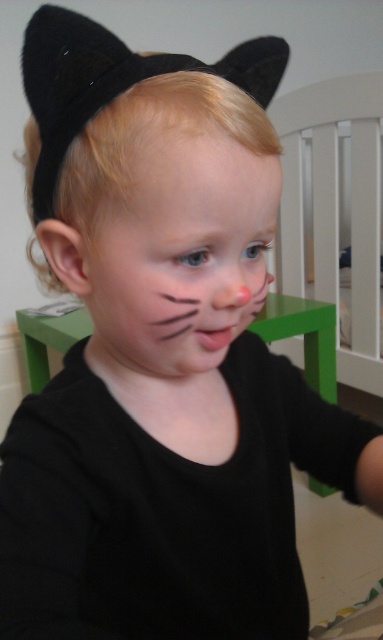
Question: Is matte black face at center to the left of smooth skin at center from the viewer's perspective?

Choices:
 (A) no
 (B) yes

Answer: (B)

Question: Which of the following is the closest to the observer?

Choices:
 (A) (173, 166)
 (B) (160, 164)

Answer: (A)

Question: Is matte black face at center further to camera compared to smooth skin at center?

Choices:
 (A) no
 (B) yes

Answer: (A)

Question: Which point is closer to the camera taking this photo?

Choices:
 (A) (147, 344)
 (B) (253, 202)

Answer: (B)

Question: Where is matte black face at center located in relation to smooth skin at center in the image?

Choices:
 (A) above
 (B) below

Answer: (B)